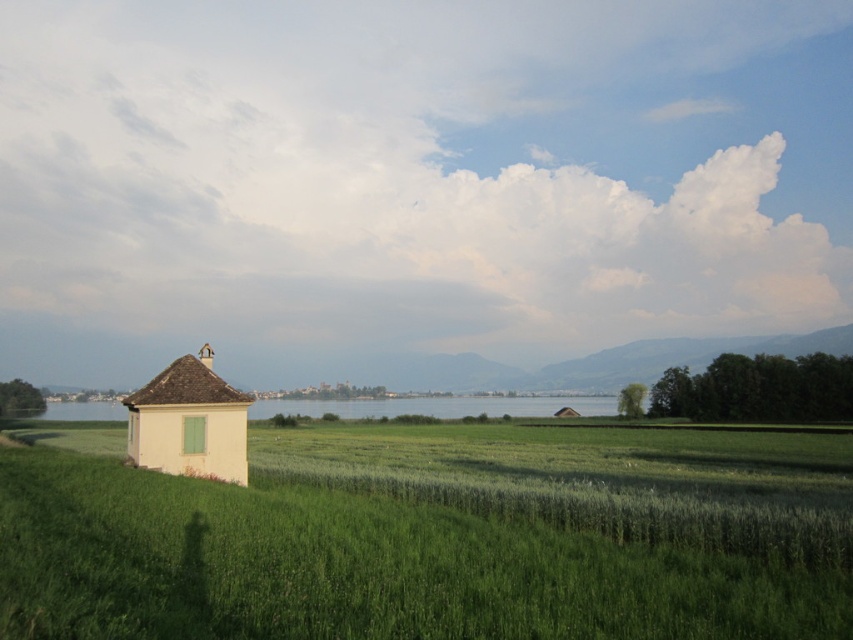
Question: Does white matte hut at left have a lesser width compared to clear blue water at center?

Choices:
 (A) yes
 (B) no

Answer: (A)

Question: Can you confirm if green grassy field at lower left is positioned to the right of clear blue water at center?

Choices:
 (A) yes
 (B) no

Answer: (A)

Question: Which of these objects is positioned closest to the clear blue water at center?

Choices:
 (A) green grassy field at lower left
 (B) white matte hut at left

Answer: (B)

Question: Can you confirm if white matte hut at left is thinner than clear blue water at center?

Choices:
 (A) no
 (B) yes

Answer: (B)

Question: Which point appears closest to the camera in this image?

Choices:
 (A) (540, 528)
 (B) (332, 412)

Answer: (A)

Question: Which of the following is the farthest from the observer?

Choices:
 (A) (759, 602)
 (B) (489, 408)
 (C) (135, 422)

Answer: (B)